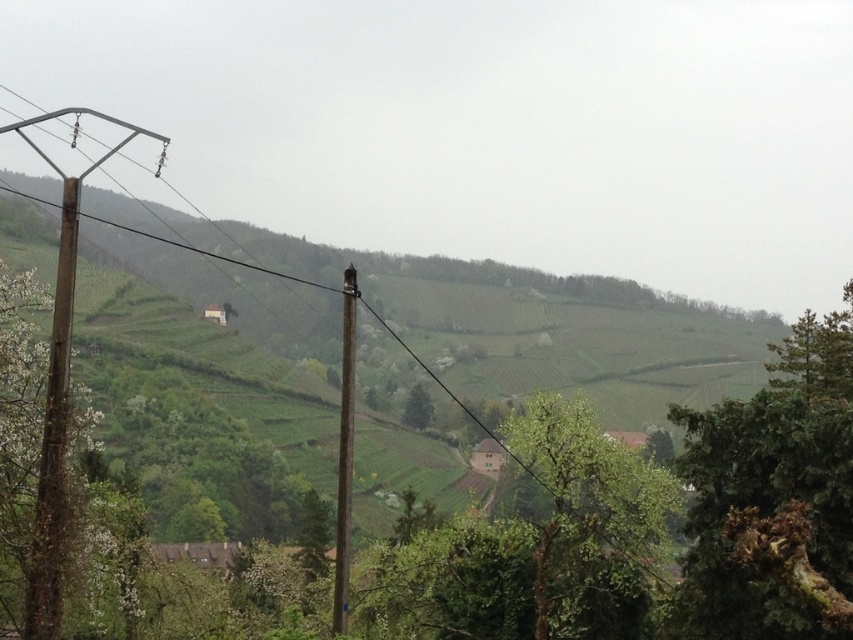
Is brown wooden telegraph pole at center further to the viewer compared to green leafy tree at center?

That is False.

Looking at this image, how distant is brown wooden telegraph pole at center from green leafy tree at center?

They are 124.92 meters apart.

Image resolution: width=853 pixels, height=640 pixels. I want to click on brown wooden telegraph pole at center, so click(x=345, y=452).

Does green leafy tree at upper right have a greater height compared to brown wooden telegraph pole at center?

No, green leafy tree at upper right is not taller than brown wooden telegraph pole at center.

Does point (679, 422) come behind point (351, 392)?

Yes, point (679, 422) is behind point (351, 392).

Locate an element on the screen. green leafy tree at upper right is located at coordinates (773, 497).

Can you confirm if brown wooden telegraph pole at left is positioned below green leafy tree at center?

No, brown wooden telegraph pole at left is not below green leafy tree at center.

Does point (67, 227) come closer to viewer compared to point (422, 388)?

Yes, it is.

I want to click on brown wooden telegraph pole at left, so click(x=54, y=442).